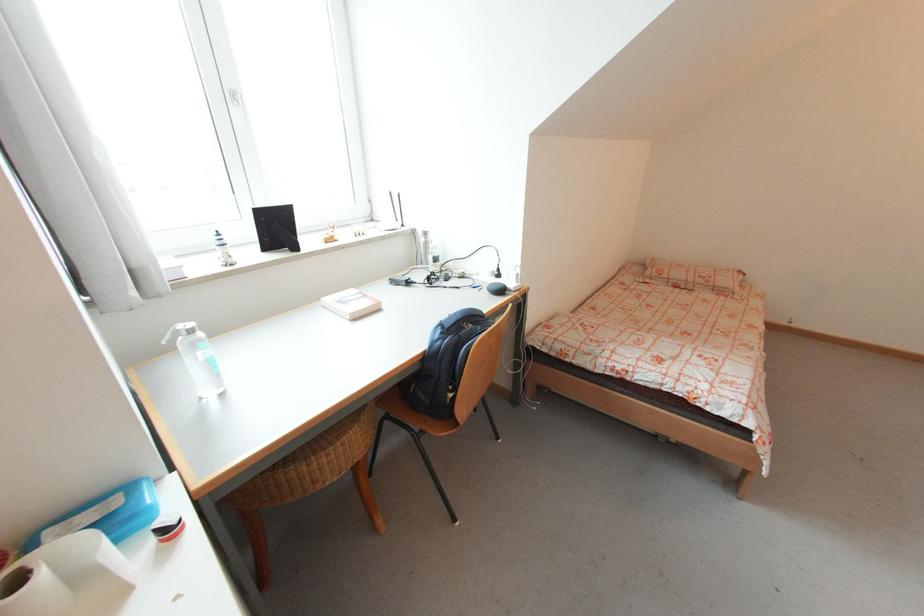
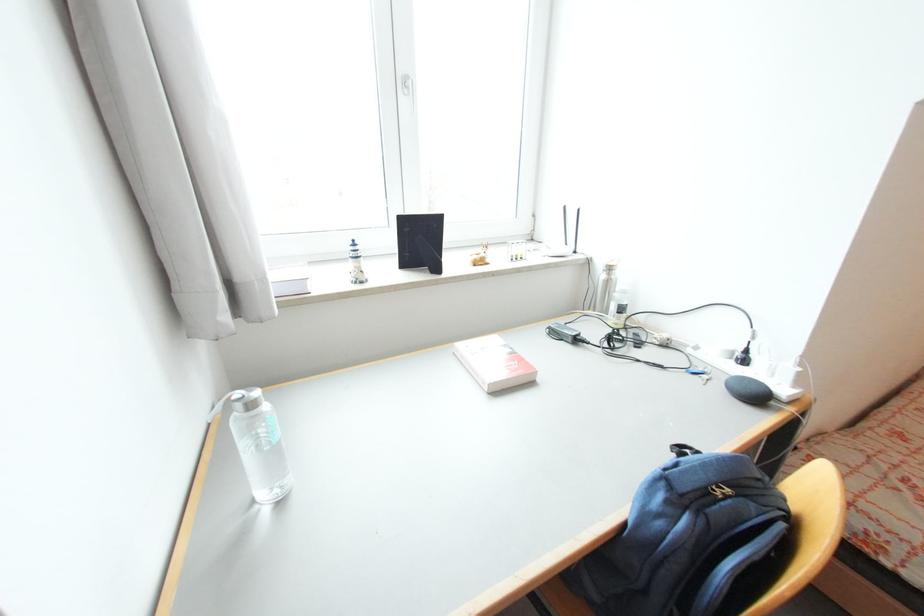
Locate, in the second image, the point that corresponds to point (239, 103) in the first image.

(411, 91)